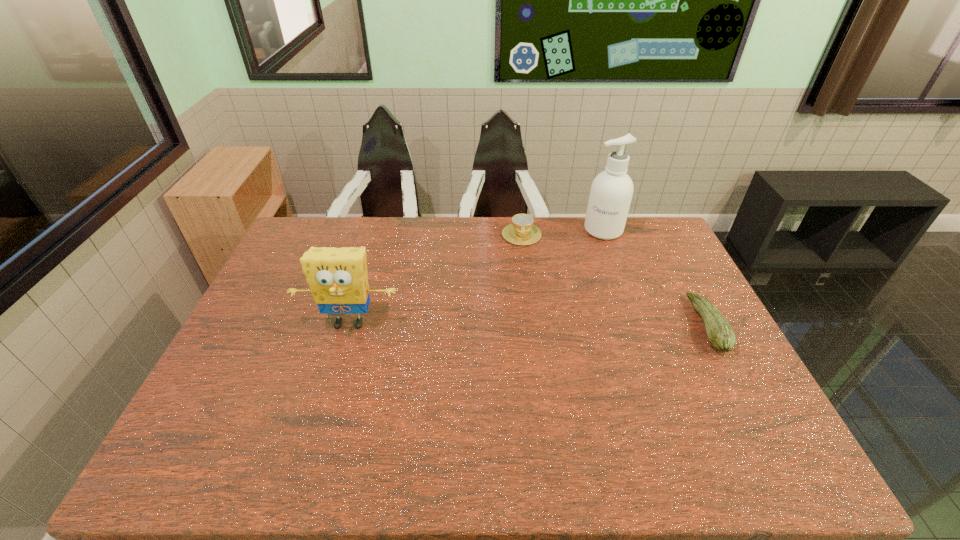
I want to click on vacant area between the third object from right to left and the leftmost object, so click(436, 279).

Where is `free spot between the zucchini and the leftmost object`? The width and height of the screenshot is (960, 540). free spot between the zucchini and the leftmost object is located at coordinates (528, 324).

Locate an element on the screen. Image resolution: width=960 pixels, height=540 pixels. free space between the zucchini and the sponge is located at coordinates (528, 324).

What are the coordinates of `vacant area between the second object from right to left and the leftmost object` in the screenshot? It's located at (476, 276).

The height and width of the screenshot is (540, 960). In order to click on unoccupied position between the leftmost object and the rightmost object in this screenshot , I will do `click(528, 324)`.

Find the location of a particular element. The height and width of the screenshot is (540, 960). vacant region between the tallest object and the sponge is located at coordinates (476, 276).

Locate an element on the screen. The image size is (960, 540). free space between the rightmost object and the third shortest object is located at coordinates click(528, 324).

I want to click on the third closest object relative to the sponge, so click(x=720, y=334).

At what (x,y) coordinates should I click in order to perform the action: click on object identified as the third closest to the rightmost object. Please return your answer as a coordinate pair (x, y). This screenshot has width=960, height=540. Looking at the image, I should click on (338, 279).

You are a GUI agent. You are given a task and a screenshot of the screen. Output one action in this format:
    pyautogui.click(x=<x>, y=<y>)
    Task: Click on the free region that satisfies the following two spatial constraints: 1. on the face of the rightmost object; 2. at the stem end of the leftmost object
    
    Given the screenshot: What is the action you would take?
    pyautogui.click(x=348, y=325)